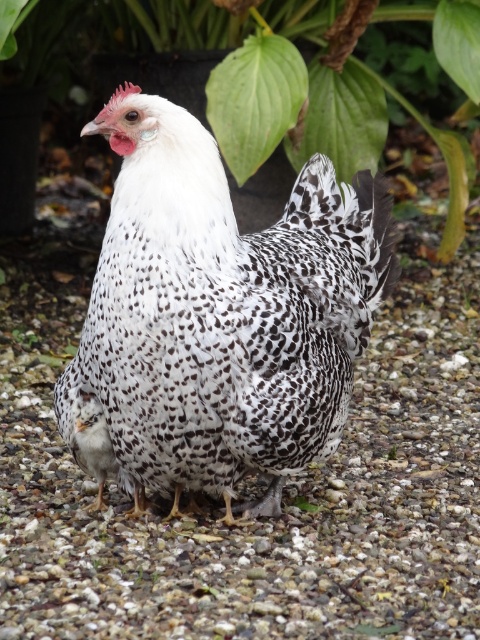
Is point (471, 422) positioned behind point (206, 362)?

That is True.

Where is `white gravel at center`? This screenshot has width=480, height=640. white gravel at center is located at coordinates (284, 490).

Is speckled feathered chicken at center below green leafy plant at upper center?

Indeed, speckled feathered chicken at center is positioned under green leafy plant at upper center.

Is point (216, 256) positioned before point (266, 64)?

Yes, point (216, 256) is closer to viewer.

Where is `speckled feathered chicken at center`? This screenshot has height=640, width=480. speckled feathered chicken at center is located at coordinates (222, 312).

The width and height of the screenshot is (480, 640). What do you see at coordinates (284, 490) in the screenshot?
I see `white gravel at center` at bounding box center [284, 490].

Locate an element on the screen. white gravel at center is located at coordinates (284, 490).

You are a GUI agent. You are given a task and a screenshot of the screen. Output one action in this format:
    pyautogui.click(x=<x>, y=<y>)
    Task: Click on the white gravel at center
    The image size is (480, 640).
    Given the screenshot: What is the action you would take?
    pyautogui.click(x=284, y=490)